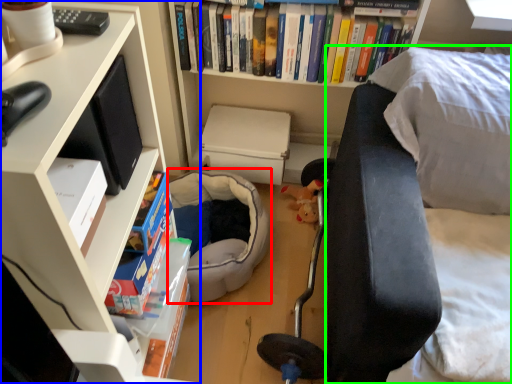
Question: Which object is the farthest from bean bag chair (highlighted by a red box)? Choose among these: bookcase (highlighted by a blue box) or couch (highlighted by a green box).

Choices:
 (A) bookcase
 (B) couch

Answer: (A)